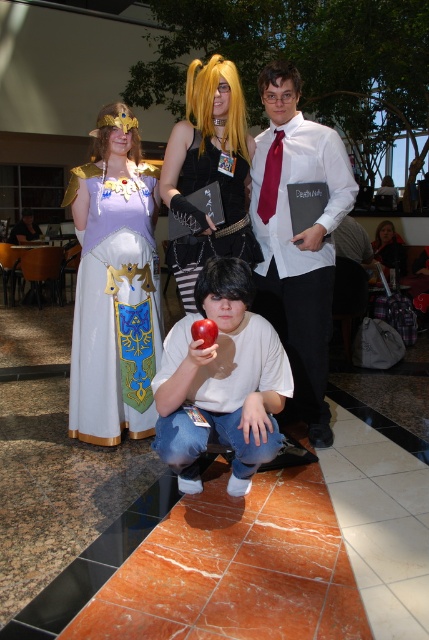
Can you confirm if shiny black book at center is positioned above red matte apple at center?

Correct, shiny black book at center is located above red matte apple at center.

Is point (193, 109) closer to camera compared to point (208, 337)?

No, it is behind (208, 337).

Does point (163, 170) lie in front of point (208, 323)?

No, (163, 170) is behind (208, 323).

Identify the location of shiny black book at center. (208, 173).

Can you confirm if white shirt at center is positioned below shiny black book at center?

Indeed, white shirt at center is positioned under shiny black book at center.

Does white shirt at center have a larger size compared to shiny black book at center?

Yes, white shirt at center is bigger than shiny black book at center.

Who is more distant from viewer, (281, 189) or (186, 250)?

Point (281, 189)

You are a GUI agent. You are given a task and a screenshot of the screen. Output one action in this format:
    pyautogui.click(x=<x>, y=<y>)
    Task: Click on the white shirt at center
    
    Given the screenshot: What is the action you would take?
    pyautogui.click(x=298, y=237)

Between white matte shirt at center and shiny black book at center, which one has more height?

With more height is shiny black book at center.

Who is higher up, white matte shirt at center or shiny black book at center?

shiny black book at center

Which is in front, point (260, 380) or point (169, 262)?

Point (260, 380) is more forward.

Identify the location of white matte shirt at center. (221, 381).